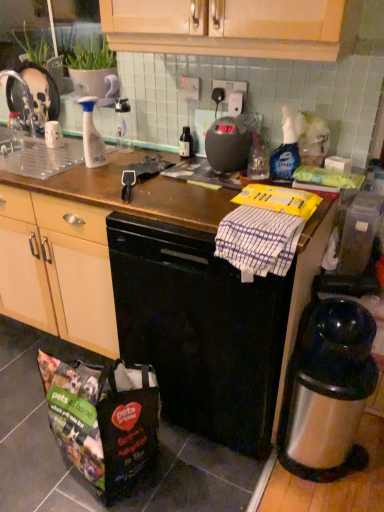
I want to click on free space above white striped towel at center (from a real-world perspective), so click(264, 219).